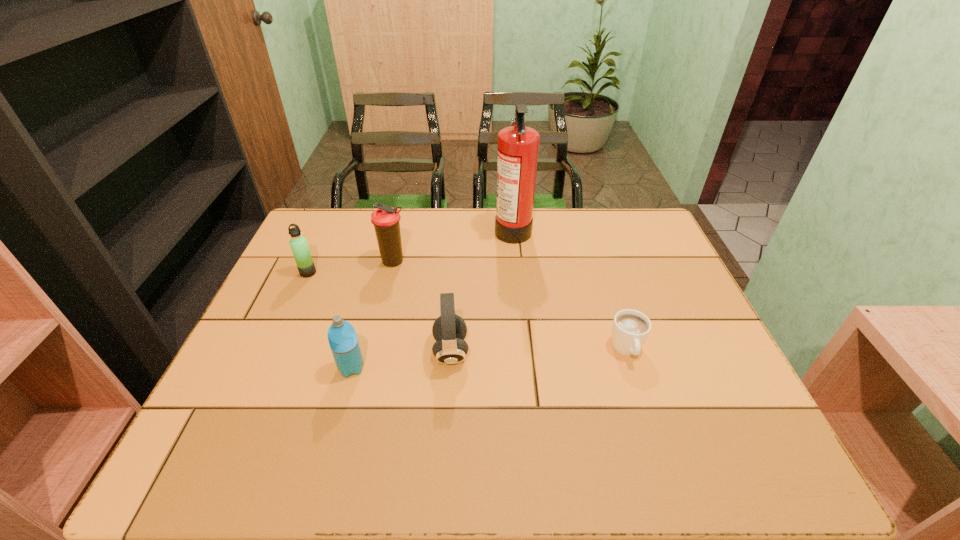
Where is `the second object from right to left`? the second object from right to left is located at coordinates (518, 145).

In order to click on fire extinguisher in this screenshot , I will do `click(518, 145)`.

You are a GUI agent. You are given a task and a screenshot of the screen. Output one action in this format:
    pyautogui.click(x=<x>, y=<y>)
    Task: Click on the tallest thermos bottle
    The height and width of the screenshot is (540, 960).
    Given the screenshot: What is the action you would take?
    pyautogui.click(x=385, y=219)

I want to click on the leftmost thermos bottle, so click(x=298, y=243).

The width and height of the screenshot is (960, 540). In order to click on the third object from right to left in this screenshot , I will do `click(449, 330)`.

Identify the location of the nearest thermos bottle. (343, 341).

The width and height of the screenshot is (960, 540). I want to click on the rightmost object, so click(x=631, y=328).

Where is `the shortest object`? The width and height of the screenshot is (960, 540). the shortest object is located at coordinates (631, 328).

In order to click on vacant space positioned 0.260m on the front-facing side of the fifth object from left to right in this screenshot , I will do `click(415, 228)`.

What are the coordinates of `blank space located on the front-facing side of the fifth object from left to right` in the screenshot? It's located at (412, 228).